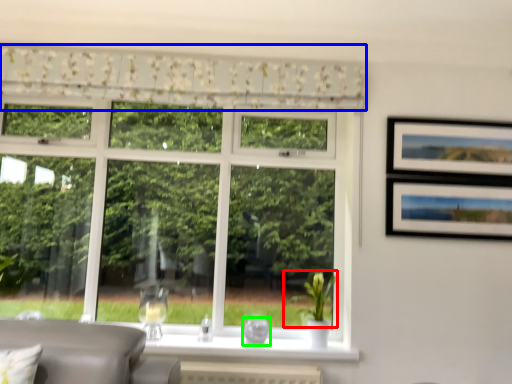
Question: Which object is the farthest from plant (highlighted by a red box)? Choose among these: curtain (highlighted by a blue box) or glass vase (highlighted by a green box).

Choices:
 (A) curtain
 (B) glass vase

Answer: (A)